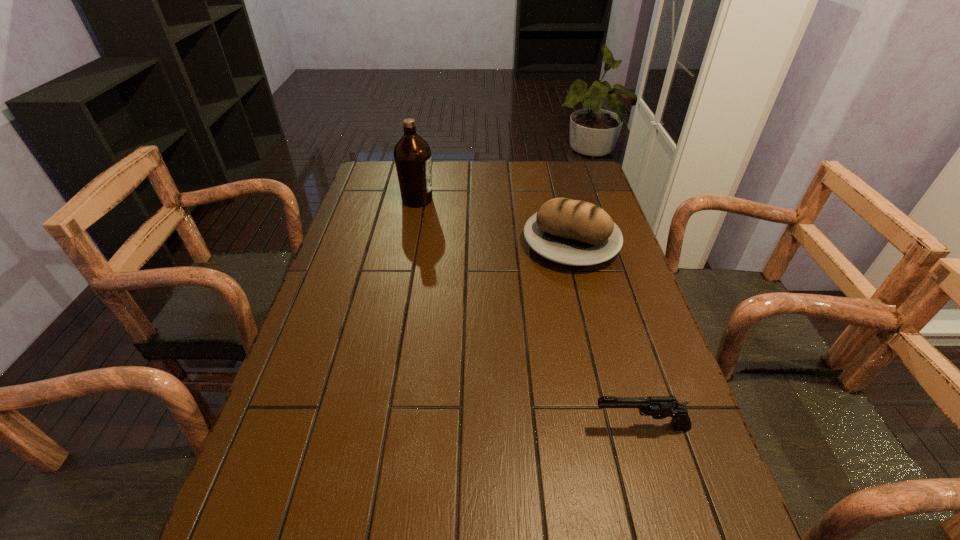
The image size is (960, 540). Identify the location of free space located 0.050m at the end of the barrel of the gun. (567, 426).

What are the coordinates of `object at the far edge` in the screenshot? It's located at (412, 154).

Find the location of `object at the left edge`. object at the left edge is located at coordinates (412, 154).

At what (x,y) coordinates should I click in order to perform the action: click on bread that is at the right edge. Please return your answer as a coordinate pair (x, y). Looking at the image, I should click on (572, 232).

Where is `gun that is positioned at the right edge`? The width and height of the screenshot is (960, 540). gun that is positioned at the right edge is located at coordinates (659, 407).

This screenshot has height=540, width=960. In order to click on object that is at the far left corner in this screenshot , I will do `click(412, 154)`.

Find the location of a particular element. vacant area at the far edge is located at coordinates (458, 167).

Image resolution: width=960 pixels, height=540 pixels. What are the coordinates of `vacant space at the left edge of the desktop` in the screenshot? It's located at (395, 220).

The height and width of the screenshot is (540, 960). Find the location of `vacant space at the right edge of the desktop`. vacant space at the right edge of the desktop is located at coordinates (601, 322).

This screenshot has width=960, height=540. In order to click on blank region between the second nearest object and the gun in this screenshot , I will do `click(606, 335)`.